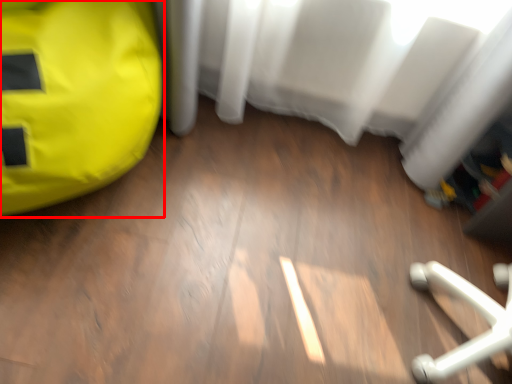
Question: From the image's perspective, what is the correct spatial positioning of bean bag chair (annotated by the red box) in reference to curtain?

Choices:
 (A) below
 (B) above

Answer: (A)